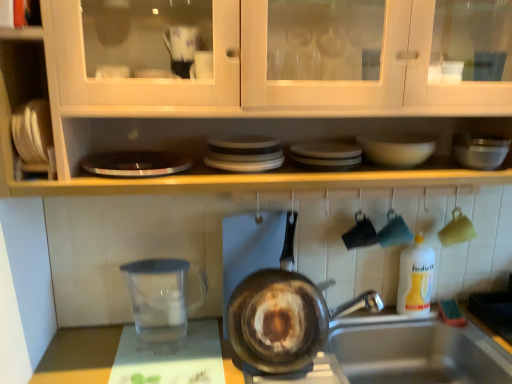
This screenshot has width=512, height=384. Identify the location of free space to the right of transparent plastic measuring cup at lower left. (203, 342).